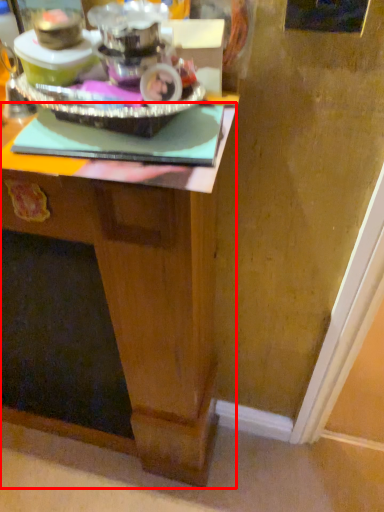
Question: In this image, where is desk (annotated by the red box) located relative to appliance?

Choices:
 (A) left
 (B) right

Answer: (A)